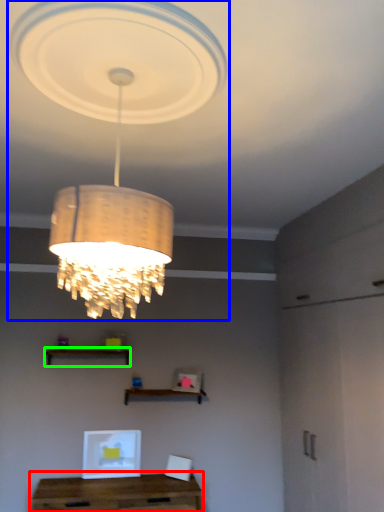
Question: Which object is the closest to the table (highlighted by a red box)? Choose among these: lamp (highlighted by a blue box) or shelf (highlighted by a green box).

Choices:
 (A) lamp
 (B) shelf

Answer: (B)